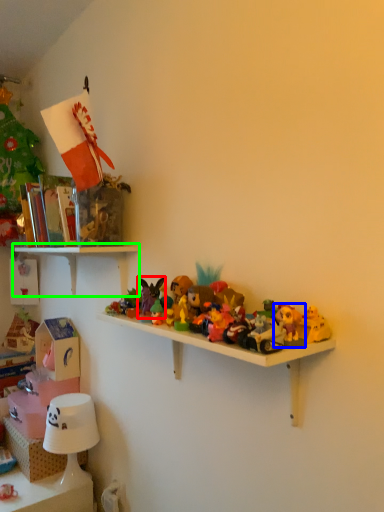
Question: Based on their relative distances, which object is farther from toy (highlighted by a red box)? Choose from toy (highlighted by a blue box) and shelf (highlighted by a green box).

Choices:
 (A) toy
 (B) shelf

Answer: (A)